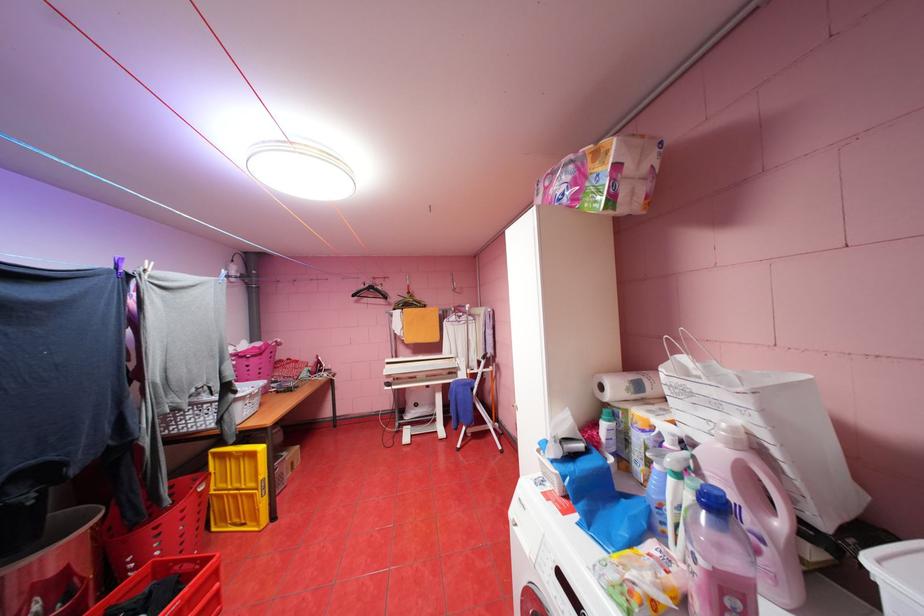
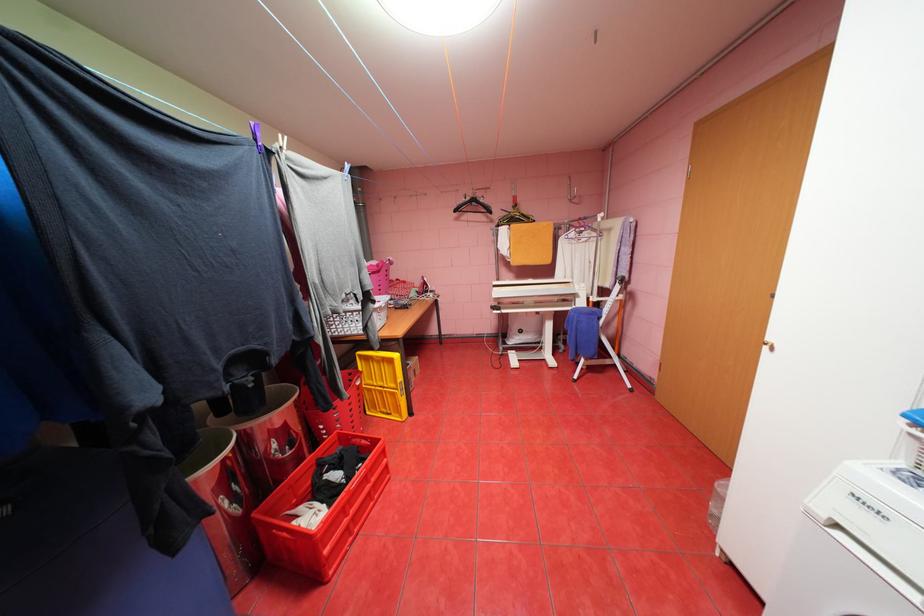
In the second image, find the point that corresponds to point 472,428 in the first image.

(591, 360)